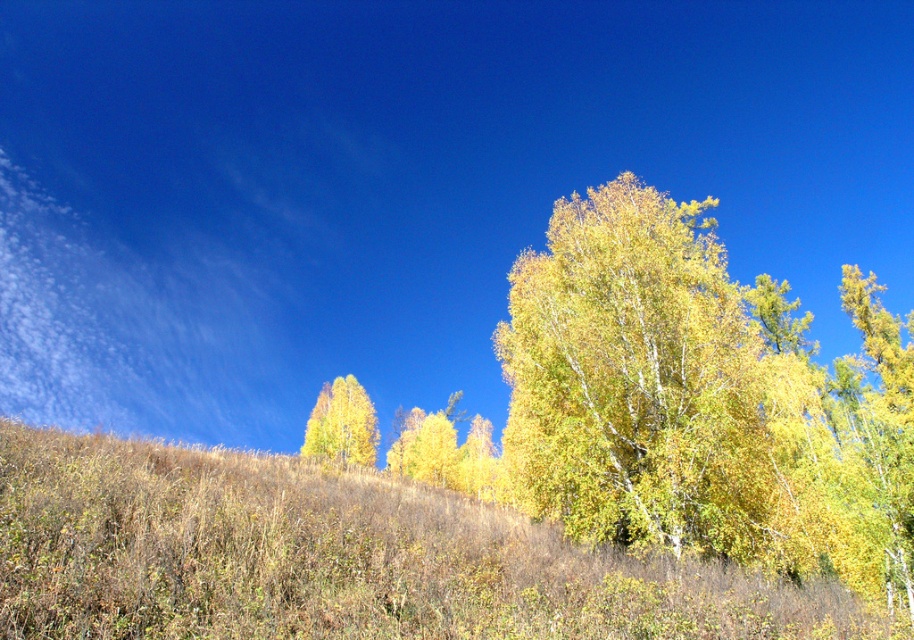
Is point (546, 550) less distant than point (336, 426)?

Yes, point (546, 550) is in front of point (336, 426).

Is brown dry grass at lower left above yellow matte tree at lower left?

Correct, brown dry grass at lower left is located above yellow matte tree at lower left.

At what (x,y) coordinates should I click in order to perform the action: click on brown dry grass at lower left. Please return your answer as a coordinate pair (x, y). Looking at the image, I should click on (339, 557).

At what (x,y) coordinates should I click in order to perform the action: click on yellow-green leaves at center. Please return your answer as a coordinate pair (x, y). This screenshot has width=914, height=640. Looking at the image, I should click on (636, 380).

Between yellow-green leaves at center and yellow matte tree at lower left, which one has more height?

With more height is yellow-green leaves at center.

This screenshot has width=914, height=640. Find the location of `yellow-green leaves at center`. yellow-green leaves at center is located at coordinates (636, 380).

Where is `yellow-green leaves at center`? Image resolution: width=914 pixels, height=640 pixels. yellow-green leaves at center is located at coordinates (636, 380).

Can you confirm if brown dry grass at lower left is positioned above yellow-green leaves at center?

No, brown dry grass at lower left is not above yellow-green leaves at center.

Which of these two, brown dry grass at lower left or yellow-green leaves at center, stands shorter?

Standing shorter between the two is brown dry grass at lower left.

Which is behind, point (857, 636) or point (629, 221)?

The point (629, 221) is behind.

Find the location of a particular element. brown dry grass at lower left is located at coordinates (339, 557).